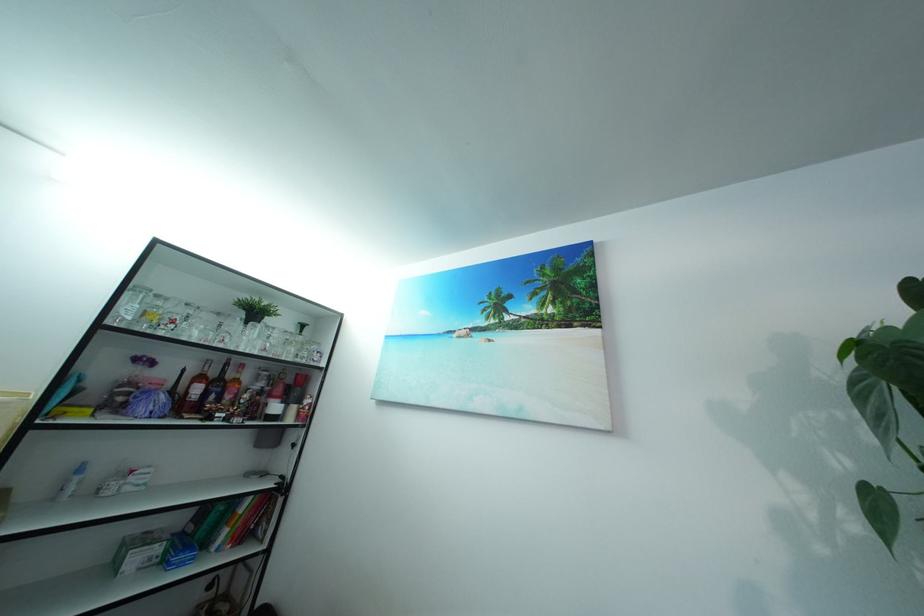
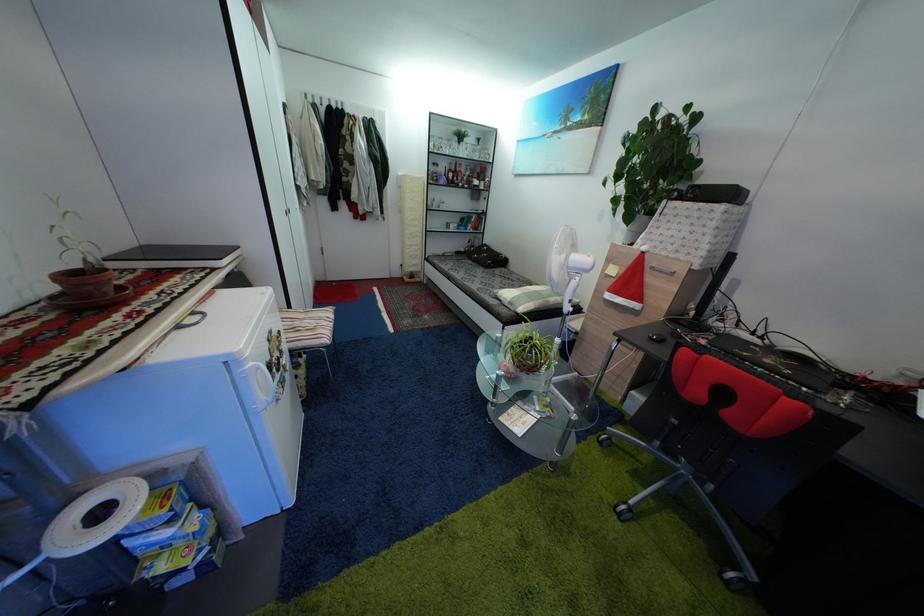
Find the pixel in the second image that matches [161,371] in the first image.

(445, 172)